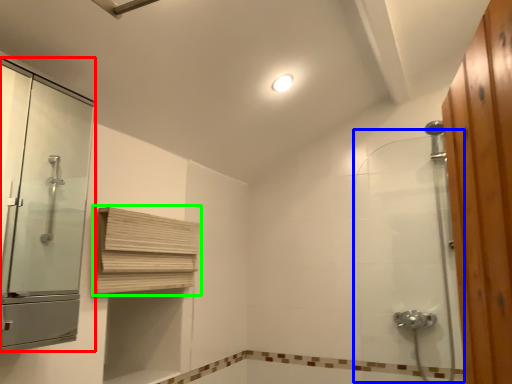
Question: Which object is the farthest from screen door (highlighted by a red box)? Choose among these: shower door (highlighted by a blue box) or shelf (highlighted by a green box).

Choices:
 (A) shower door
 (B) shelf

Answer: (A)